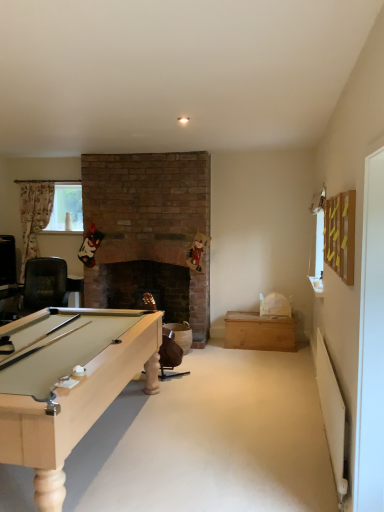
Where is `clear plastic window screen at left`? The height and width of the screenshot is (512, 384). clear plastic window screen at left is located at coordinates (66, 208).

What do you see at coordinates (66, 208) in the screenshot?
I see `clear plastic window screen at left` at bounding box center [66, 208].

Where is `light brown wood chest at center-right`? The height and width of the screenshot is (512, 384). light brown wood chest at center-right is located at coordinates (259, 332).

The image size is (384, 512). What do you see at coordinates (259, 332) in the screenshot?
I see `light brown wood chest at center-right` at bounding box center [259, 332].

Measure the distance between light brown wood chest at center-right and camera.

They are 4.93 meters apart.

You are a GUI agent. You are given a task and a screenshot of the screen. Output one action in this format:
    pyautogui.click(x=<x>, y=<y>)
    Task: Click on the clear plastic window screen at left
    The image size is (384, 512).
    Given the screenshot: What is the action you would take?
    pyautogui.click(x=66, y=208)

Is light brown wood chest at center-right at the left side of clear plastic window screen at left?

No, light brown wood chest at center-right is not to the left of clear plastic window screen at left.

From the picture: Which object is more forward, light brown wood chest at center-right or clear plastic window screen at left?

light brown wood chest at center-right is in front.

Which is closer, (271,346) or (71,227)?

Point (271,346).

From the image's perspective, is light brown wood chest at center-right on clear plastic window screen at left?

Incorrect, from the image's perspective, light brown wood chest at center-right is lower than clear plastic window screen at left.

From a real-world perspective, is light brown wood chest at center-right under clear plastic window screen at left?

Yes, from a real-world perspective, light brown wood chest at center-right is beneath clear plastic window screen at left.

Is light brown wood chest at center-right thinner than clear plastic window screen at left?

In fact, light brown wood chest at center-right might be wider than clear plastic window screen at left.

Is light brown wood chest at center-right taller or shorter than clear plastic window screen at left?

light brown wood chest at center-right is shorter than clear plastic window screen at left.

Can you confirm if light brown wood chest at center-right is bigger than clear plastic window screen at left?

Yes, light brown wood chest at center-right is bigger than clear plastic window screen at left.

Is light brown wood chest at center-right surrounding clear plastic window screen at left?

Actually, clear plastic window screen at left is outside light brown wood chest at center-right.

Is light brown wood chest at center-right next to clear plastic window screen at left and touching it?

No.

Could you tell me if light brown wood chest at center-right is turned towards clear plastic window screen at left?

No, light brown wood chest at center-right does not turn towards clear plastic window screen at left.

How different are the orientations of light brown wood chest at center-right and clear plastic window screen at left in degrees?

The facing directions of light brown wood chest at center-right and clear plastic window screen at left are 2.4 degrees apart.

In the image, there is a light brown wood chest at center-right. At what (x,y) coordinates should I click in order to perform the action: click on window screen above it (from the image's perspective). Please return your answer as a coordinate pair (x, y). Image resolution: width=384 pixels, height=512 pixels. Looking at the image, I should click on (66, 208).

Between clear plastic window screen at left and light brown wood chest at center-right, which one appears on the right side from the viewer's perspective?

Positioned to the right is light brown wood chest at center-right.

Which object is closer to the camera taking this photo, clear plastic window screen at left or light brown wood chest at center-right?

light brown wood chest at center-right is closer to the camera.

Which is nearer, (x=73, y=220) or (x=251, y=324)?

Point (x=73, y=220) is positioned farther from the camera compared to point (x=251, y=324).

Looking at this image, from the image's perspective, which one is positioned lower, clear plastic window screen at left or light brown wood chest at center-right?

light brown wood chest at center-right.

From a real-world perspective, which is physically above, clear plastic window screen at left or light brown wood chest at center-right?

From a 3D spatial view, clear plastic window screen at left is above.

Which of these two, clear plastic window screen at left or light brown wood chest at center-right, is wider?

With larger width is light brown wood chest at center-right.

Considering the sizes of clear plastic window screen at left and light brown wood chest at center-right in the image, is clear plastic window screen at left taller or shorter than light brown wood chest at center-right?

Clearly, clear plastic window screen at left is taller compared to light brown wood chest at center-right.

Can you confirm if clear plastic window screen at left is smaller than light brown wood chest at center-right?

Yes.

In the scene shown: Is clear plastic window screen at left completely or partially outside of light brown wood chest at center-right?

Yes, clear plastic window screen at left is not within light brown wood chest at center-right.

Based on the photo, is clear plastic window screen at left far from light brown wood chest at center-right?

clear plastic window screen at left is far away from light brown wood chest at center-right.

Does clear plastic window screen at left turn towards light brown wood chest at center-right?

No, clear plastic window screen at left is not facing towards light brown wood chest at center-right.

Image resolution: width=384 pixels, height=512 pixels. In order to click on window screen located above the light brown wood chest at center-right (from a real-world perspective) in this screenshot , I will do click(x=66, y=208).

Identify the location of window screen that is above the light brown wood chest at center-right (from the image's perspective). (66, 208).

At what (x,y) coordinates should I click in order to perform the action: click on window screen on the left of light brown wood chest at center-right. Please return your answer as a coordinate pair (x, y). The height and width of the screenshot is (512, 384). Looking at the image, I should click on (66, 208).